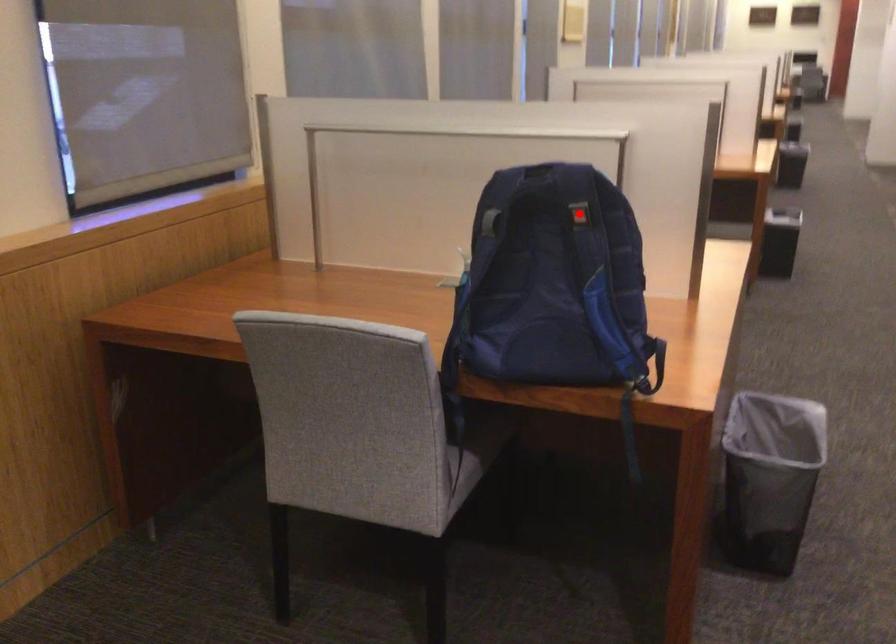
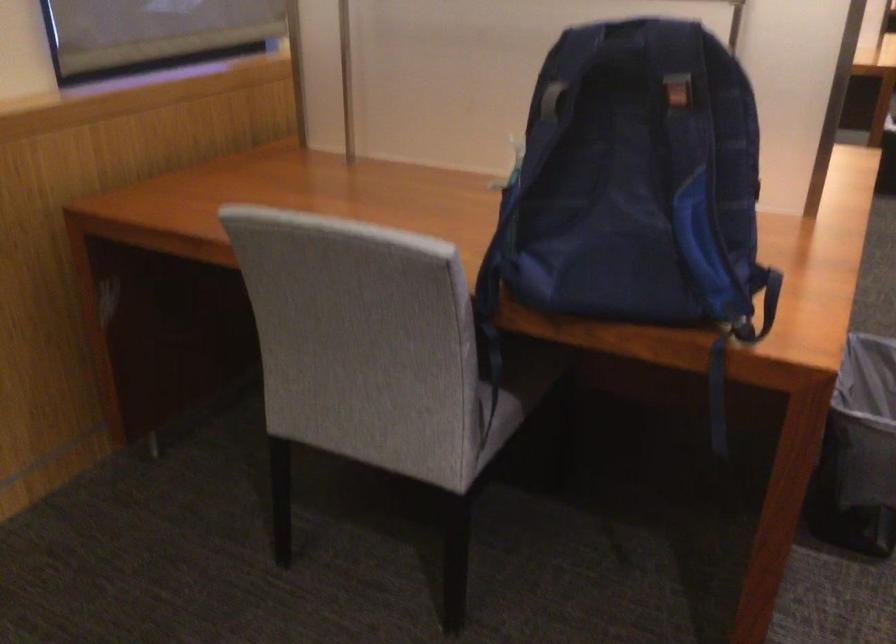
Where in the second image is the point corresponding to the highlighted location from the first image?

(677, 93)